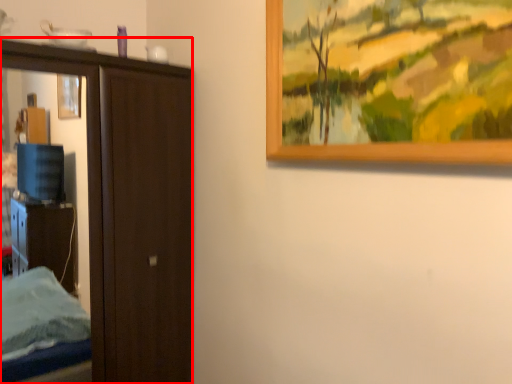
Question: From the image's perspective, what is the correct spatial positioning of door (annotated by the red box) in reference to picture frame?

Choices:
 (A) above
 (B) below

Answer: (B)